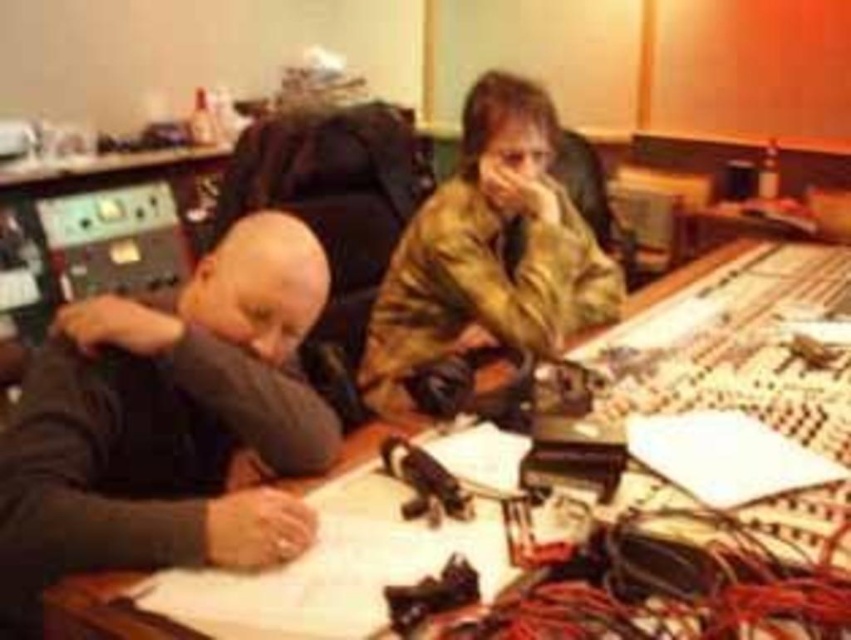
You are a sound engineer working in the studio. You need to place a new microphone stand exactly at the center of the white paper at center. What are the coordinates where you should place it?

The coordinates for the white paper at center are at point (293, 573), so place the microphone stand there.

You are a sound engineer in a busy studio. You need to place a microphone stand between the white paper at center and the dark gray sweater at left. Will the stand fit vertically between them?

The white paper at center is much taller than the dark gray sweater at left, so the microphone stand may not fit vertically between them if the space between their heights is insufficient.

You are an audio engineer who needs to access the dark gray sweater at left. Is the white paper at center blocking your access to it?

The white paper at center is in front of the dark gray sweater at left, so it is blocking access to the dark gray sweater at left.